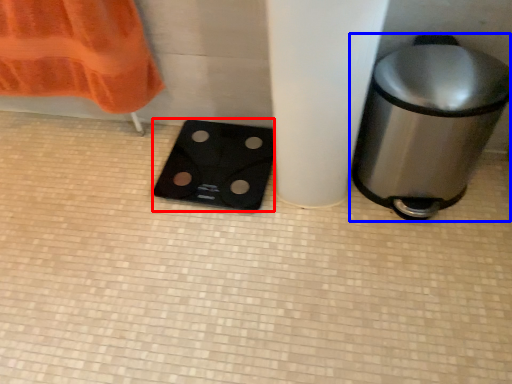
Question: Among these objects, which one is nearest to the camera, appliance (highlighted by a red box) or waste container (highlighted by a blue box)?

Choices:
 (A) appliance
 (B) waste container

Answer: (B)